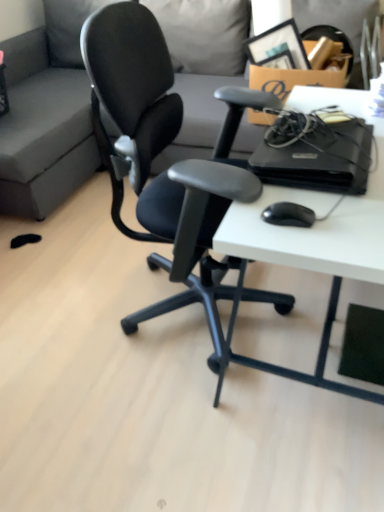
Question: Does black plastic computer at right have a greater width compared to black matte mouse at lower right?

Choices:
 (A) no
 (B) yes

Answer: (B)

Question: Does black plastic computer at right have a smaller size compared to black matte mouse at lower right?

Choices:
 (A) no
 (B) yes

Answer: (A)

Question: Are black plastic computer at right and black matte mouse at lower right beside each other?

Choices:
 (A) yes
 (B) no

Answer: (B)

Question: Does black plastic computer at right turn towards black matte mouse at lower right?

Choices:
 (A) yes
 (B) no

Answer: (B)

Question: Is black plastic computer at right taller than black matte mouse at lower right?

Choices:
 (A) no
 (B) yes

Answer: (B)

Question: Could black matte mouse at lower right be considered to be inside black plastic computer at right?

Choices:
 (A) yes
 (B) no

Answer: (B)

Question: Is gray fabric couch at upper center wider than black plastic computer at right?

Choices:
 (A) no
 (B) yes

Answer: (B)

Question: Is gray fabric couch at upper center taller than black plastic computer at right?

Choices:
 (A) yes
 (B) no

Answer: (A)

Question: Would you say gray fabric couch at upper center contains black plastic computer at right?

Choices:
 (A) no
 (B) yes

Answer: (A)

Question: Is gray fabric couch at upper center next to black plastic computer at right and touching it?

Choices:
 (A) no
 (B) yes

Answer: (A)

Question: From a real-world perspective, is gray fabric couch at upper center on top of black plastic computer at right?

Choices:
 (A) yes
 (B) no

Answer: (B)

Question: Is gray fabric couch at upper center thinner than black plastic computer at right?

Choices:
 (A) no
 (B) yes

Answer: (A)

Question: Is white matte desk at center wider than black plastic computer at right?

Choices:
 (A) no
 (B) yes

Answer: (B)